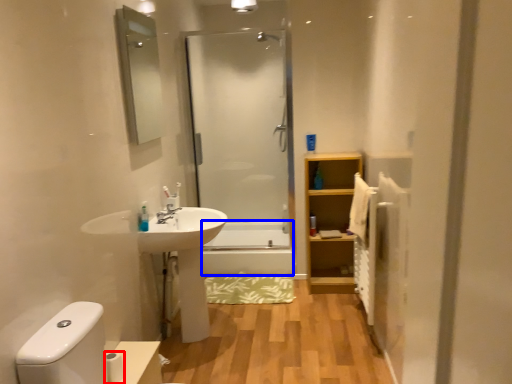
Question: Which object appears closest to the camera in this image, toilet paper (highlighted by a red box) or bath (highlighted by a blue box)?

Choices:
 (A) toilet paper
 (B) bath

Answer: (A)